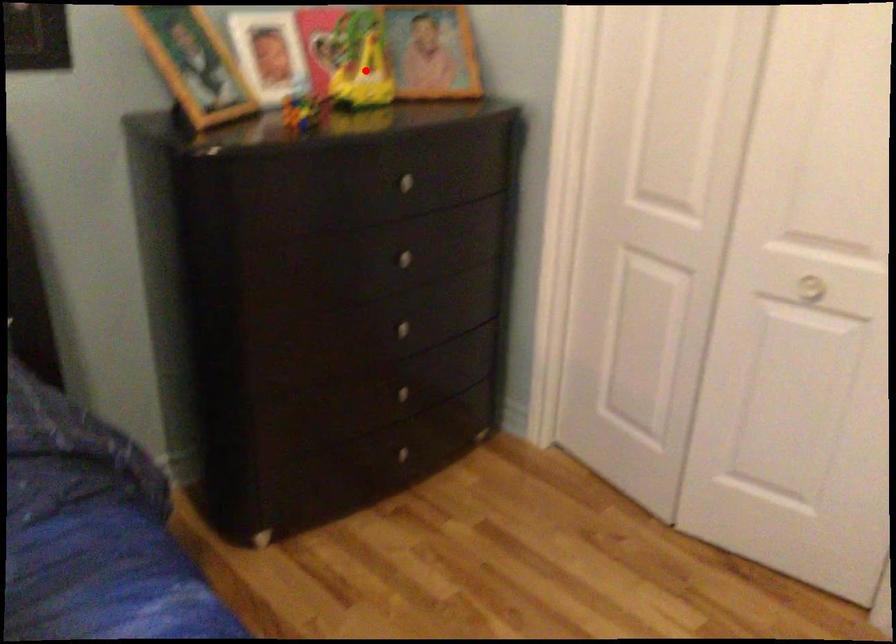
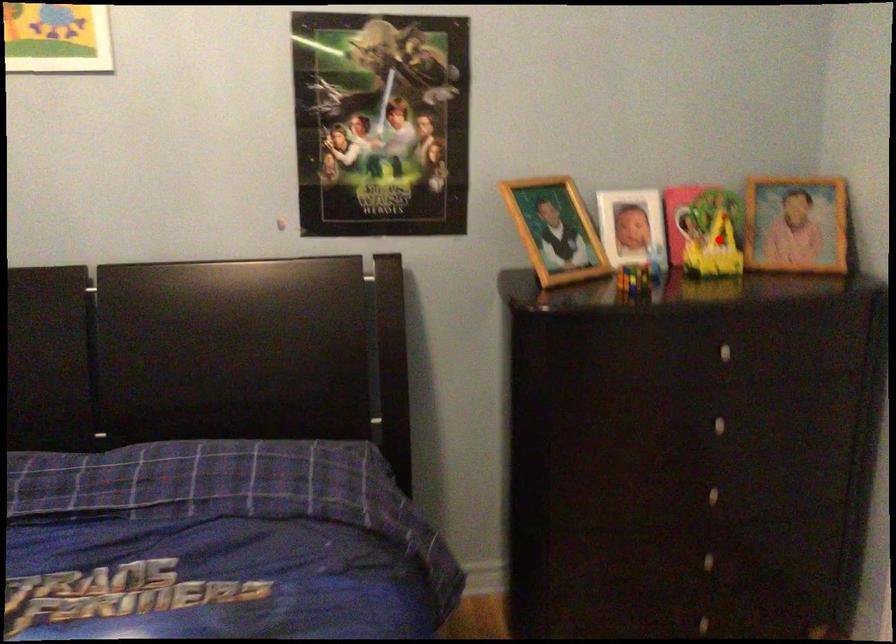
I am providing you with two images of the same scene from different viewpoints. A red point is marked on the first image and another point is marked on the second image. Is the marked point in image1 the same physical position as the marked point in image2?

Yes